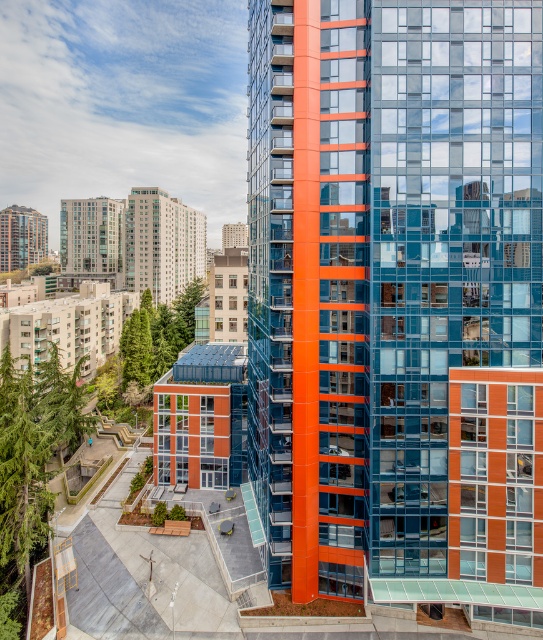
How much distance is there between orange glass building at center and matte glass building at upper left?

664.24 feet

Does orange glass building at center appear on the left side of matte glass building at upper left?

In fact, orange glass building at center is to the right of matte glass building at upper left.

The height and width of the screenshot is (640, 543). I want to click on orange glass building at center, so click(395, 291).

Identify the location of orange glass building at center. This screenshot has height=640, width=543. (395, 291).

Does point (66, 220) come in front of point (34, 221)?

Yes, it is.

Identify the location of matte glass building at upper left. This screenshot has height=640, width=543. pos(91,241).

Who is positioned more to the right, orange glass building at center or matte glass building at center?

orange glass building at center

Which is below, orange glass building at center or matte glass building at center?

orange glass building at center

Locate an element on the screen. The height and width of the screenshot is (640, 543). orange glass building at center is located at coordinates (395, 291).